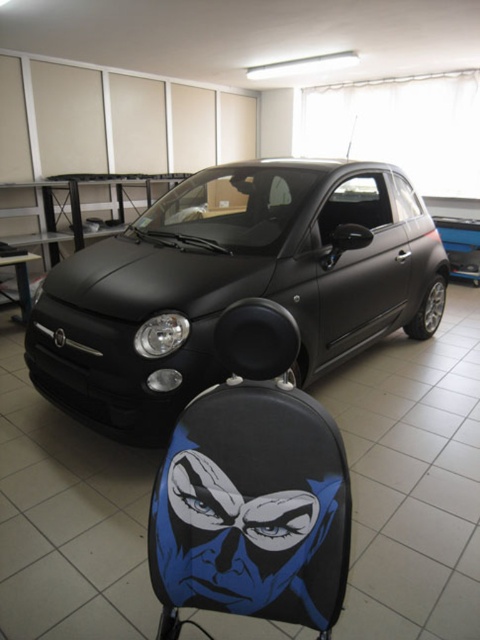
Question: Is matte black car at center closer to camera compared to blue matte/comic book character at center?

Choices:
 (A) no
 (B) yes

Answer: (A)

Question: Is matte black car at center bigger than blue matte/comic book character at center?

Choices:
 (A) yes
 (B) no

Answer: (A)

Question: Which of the following is the farthest from the observer?

Choices:
 (A) (287, 596)
 (B) (289, 269)

Answer: (B)

Question: Which of the following is the closest to the observer?

Choices:
 (A) (320, 244)
 (B) (280, 596)

Answer: (B)

Question: Does matte black car at center have a larger size compared to blue matte/comic book character at center?

Choices:
 (A) no
 (B) yes

Answer: (B)

Question: Which point is closer to the camera taking this photo?

Choices:
 (A) (39, 317)
 (B) (275, 572)

Answer: (B)